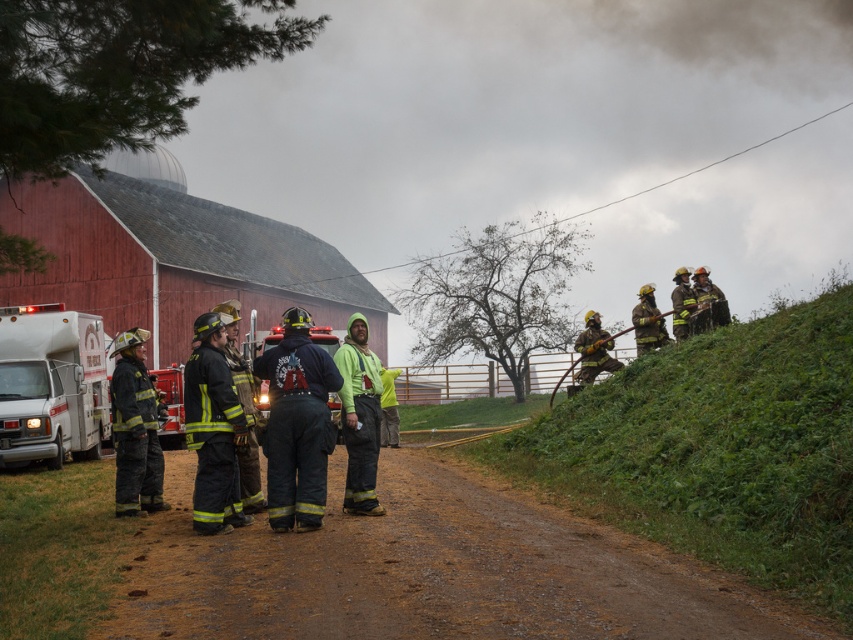
How much distance is there between green grassy hillside at upper right and reflective silver helmet at left?

green grassy hillside at upper right is 21.27 feet away from reflective silver helmet at left.

Can you confirm if green grassy hillside at upper right is thinner than reflective silver helmet at left?

In fact, green grassy hillside at upper right might be wider than reflective silver helmet at left.

Does point (833, 328) come farther from viewer compared to point (137, 371)?

Yes, it is.

Find the location of a particular element. green grassy hillside at upper right is located at coordinates (718, 449).

Between reflective silver helmet at center and shiny silver helmet at upper right, which one is positioned lower?

reflective silver helmet at center is below.

Which of these two, reflective silver helmet at center or shiny silver helmet at upper right, stands shorter?

reflective silver helmet at center

Does point (245, 497) come farther from viewer compared to point (689, 292)?

No, it is not.

The width and height of the screenshot is (853, 640). In order to click on reflective silver helmet at center in this screenshot , I will do `click(242, 410)`.

Does red wooden barn at left have a lesser height compared to black matte uniform at center?

In fact, red wooden barn at left may be taller than black matte uniform at center.

In the scene shown: Does red wooden barn at left have a greater width compared to black matte uniform at center?

Yes.

Looking at this image, who is more forward, (210, 250) or (206, 403)?

Point (206, 403) is more forward.

The height and width of the screenshot is (640, 853). Identify the location of red wooden barn at left. (172, 256).